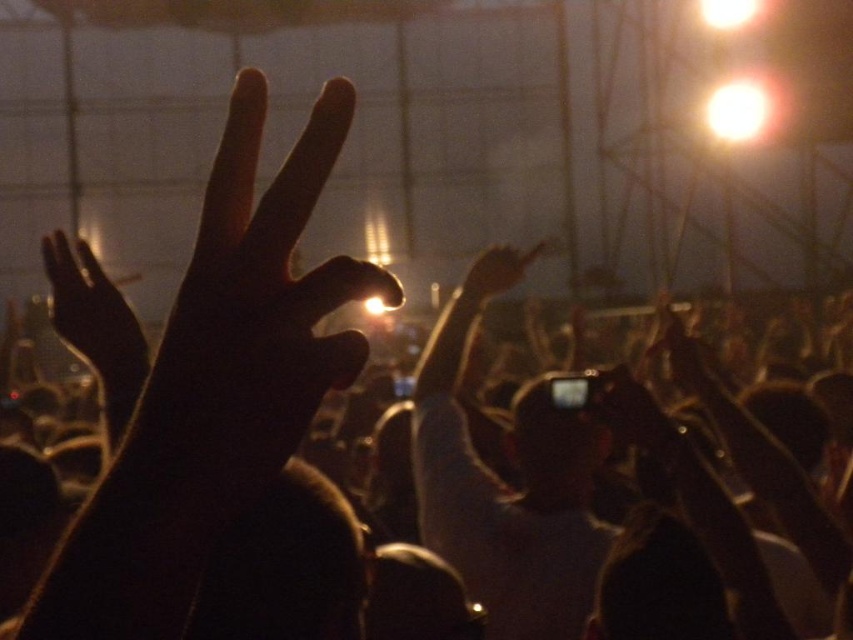
Question: Where is black matte hand at center located in relation to black matte hand at upper left in the image?

Choices:
 (A) above
 (B) below

Answer: (B)

Question: Observing the image, what is the correct spatial positioning of black matte hand at upper left in reference to matte black hand at upper center?

Choices:
 (A) left
 (B) right

Answer: (A)

Question: From the image, what is the correct spatial relationship of black matte hand at center in relation to matte black hand at upper center?

Choices:
 (A) below
 (B) above

Answer: (A)

Question: Which is farther from the matte black hand at upper center?

Choices:
 (A) black matte hand at upper left
 (B) black matte hand at center

Answer: (B)

Question: Which point appears farthest from the camera in this image?

Choices:
 (A) (74, 244)
 (B) (187, 604)

Answer: (A)

Question: Which of the following is the farthest from the observer?

Choices:
 (A) black matte hand at upper left
 (B) black matte hand at center

Answer: (A)